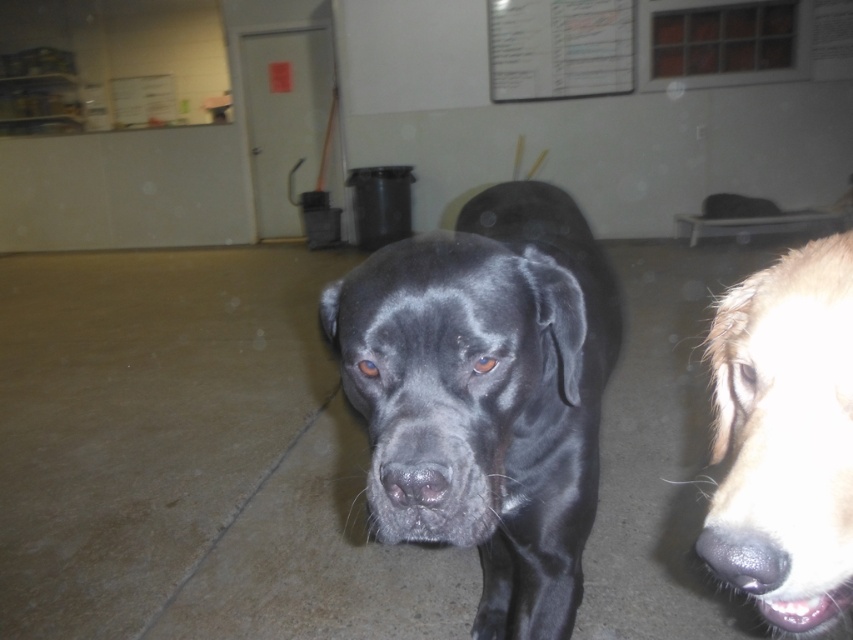
Can you confirm if shiny black dog at center is wider than shiny golden fur at center?

Yes.

Is point (570, 568) positioned before point (825, 416)?

No.

Identify the location of shiny black dog at center. This screenshot has width=853, height=640. (486, 394).

Is point (811, 403) farther from camera compared to point (520, 4)?

No, it is not.

Is shiny golden fur at center smaller than white paper at upper center?

Yes.

This screenshot has height=640, width=853. Describe the element at coordinates (785, 436) in the screenshot. I see `shiny golden fur at center` at that location.

The image size is (853, 640). I want to click on shiny golden fur at center, so click(x=785, y=436).

Who is higher up, shiny black dog at center or white paper at upper center?

white paper at upper center is above.

Does shiny black dog at center lie behind white paper at upper center?

No.

At what (x,y) coordinates should I click in order to perform the action: click on shiny black dog at center. Please return your answer as a coordinate pair (x, y). Looking at the image, I should click on (486, 394).